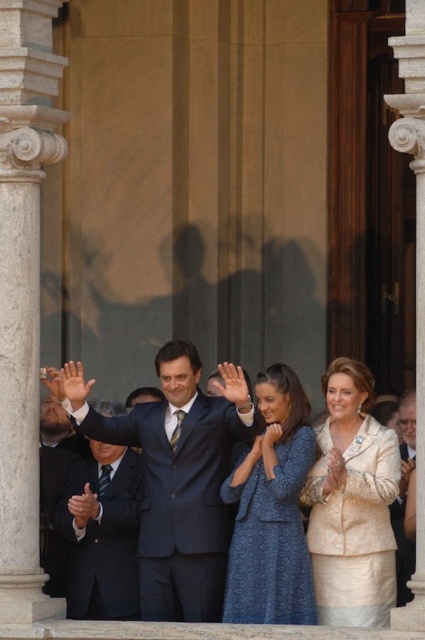
Question: Which object is positioned closest to the blue textured dress at center?

Choices:
 (A) dark blue pinstripe suit at center
 (B) gold textured suit at center
 (C) matte black hand at center

Answer: (B)

Question: Is blue textured dress at center bigger than matte black suit at center?

Choices:
 (A) yes
 (B) no

Answer: (A)

Question: Which object is farther from the camera taking this photo?

Choices:
 (A) matte black hand at center
 (B) matte black suit at center

Answer: (B)

Question: Can you confirm if white marble column at left is positioned below blue textured dress at center?

Choices:
 (A) no
 (B) yes

Answer: (A)

Question: Which object is the closest to the matte black hand at center?

Choices:
 (A) blue textured dress at center
 (B) gold textured suit at center

Answer: (A)

Question: Does gold textured suit at center have a smaller size compared to matte black suit at center?

Choices:
 (A) yes
 (B) no

Answer: (B)